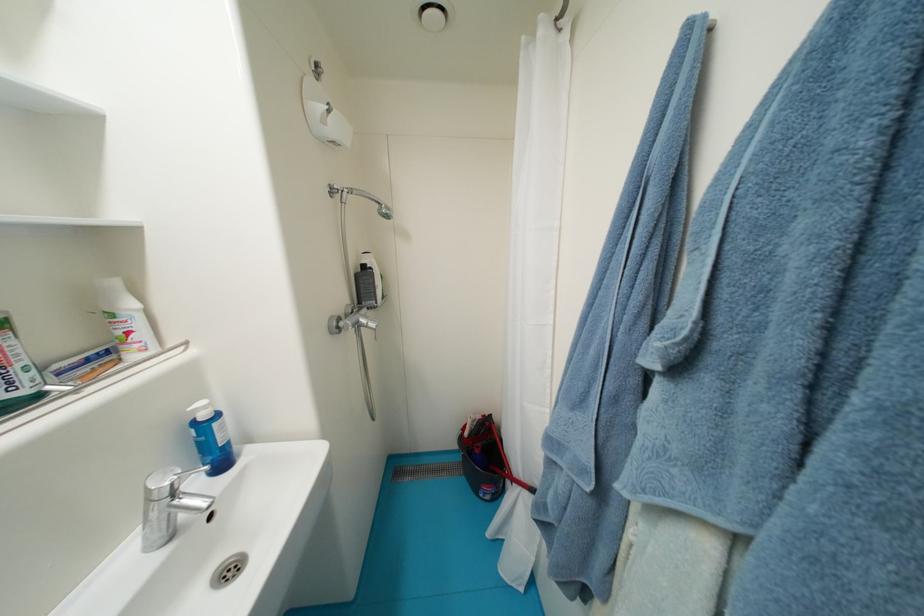
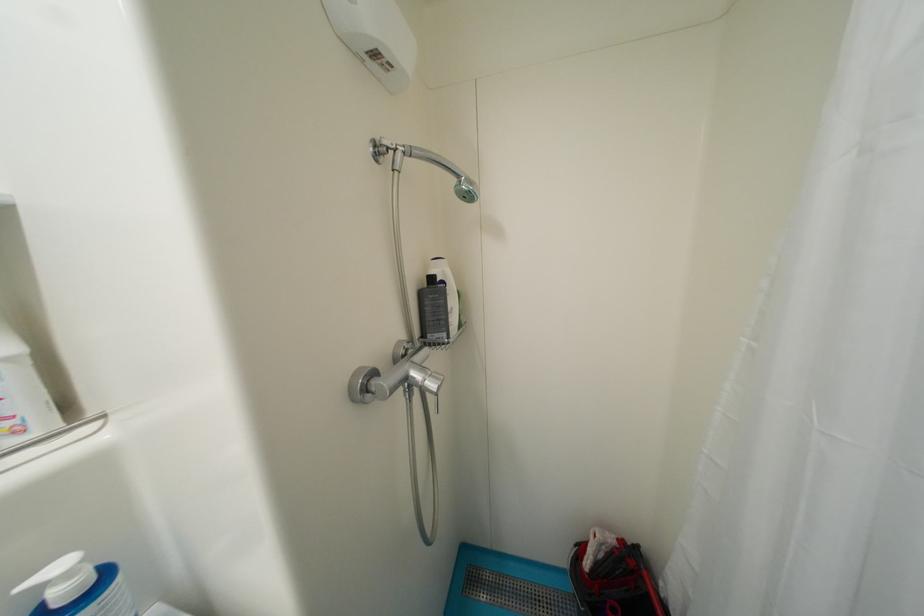
Find the pixel in the second image that matches pixel 213 408 in the first image.

(75, 576)